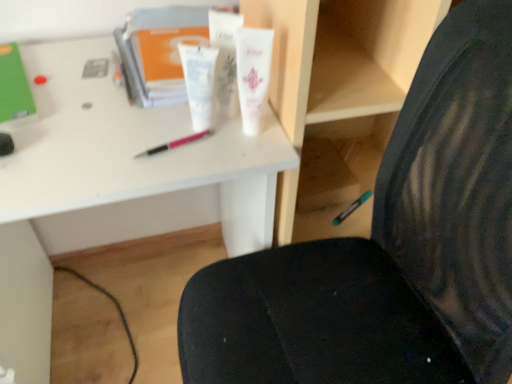
Identify the location of vacant area that lies between green matte folder at upper left, the second stationery from the back, and white matte tube at center, positioned as the first toiletry in right-to-left order. (93, 107).